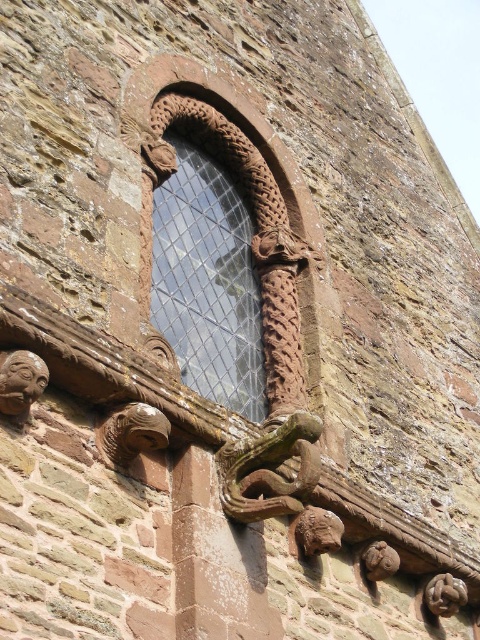
Between carved stone window at upper center and matte stone face at upper left, which one has more height?

→ carved stone window at upper center

Does point (240, 385) come closer to viewer compared to point (0, 365)?

That is False.

Who is more forward, [197,317] or [46,381]?

Point [46,381] is in front.

This screenshot has height=640, width=480. I want to click on carved stone window at upper center, so click(207, 282).